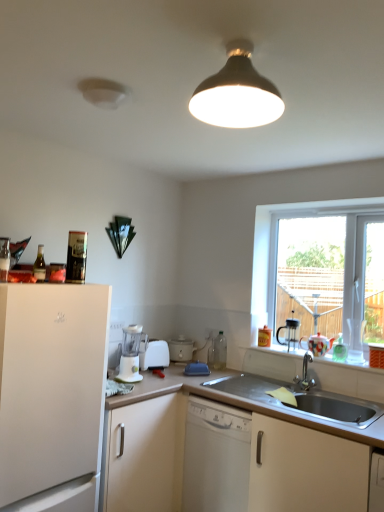
I want to click on vacant space underneath matte white slow cooker at center, marked as the second appliance in a left-to-right arrangement (from a real-world perspective), so click(187, 358).